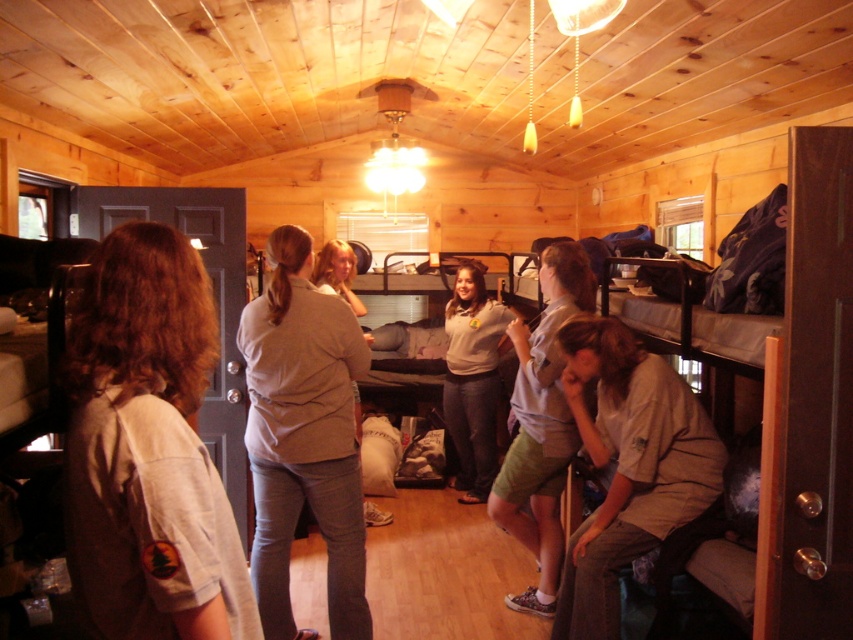
Which is above, gray cotton shirt at lower right or blonde hair at center?

blonde hair at center is above.

Can you confirm if gray cotton shirt at lower right is positioned above blonde hair at center?

Incorrect, gray cotton shirt at lower right is not positioned above blonde hair at center.

This screenshot has height=640, width=853. Find the location of `gray cotton shirt at lower right`. gray cotton shirt at lower right is located at coordinates tap(628, 465).

Find the location of a particular element. The image size is (853, 640). gray cotton shirt at lower right is located at coordinates (628, 465).

Does tan fabric shirt at center have a greater width compared to gray cotton shirt at lower right?

In fact, tan fabric shirt at center might be narrower than gray cotton shirt at lower right.

Consider the image. Is tan fabric shirt at center smaller than gray cotton shirt at lower right?

No, tan fabric shirt at center is not smaller than gray cotton shirt at lower right.

Is point (296, 406) positioned behind point (605, 577)?

That is True.

Identify the location of tan fabric shirt at center. pyautogui.click(x=303, y=436).

The width and height of the screenshot is (853, 640). What do you see at coordinates (628, 465) in the screenshot?
I see `gray cotton shirt at lower right` at bounding box center [628, 465].

What do you see at coordinates (628, 465) in the screenshot? I see `gray cotton shirt at lower right` at bounding box center [628, 465].

Locate an element on the screen. The height and width of the screenshot is (640, 853). gray cotton shirt at lower right is located at coordinates (628, 465).